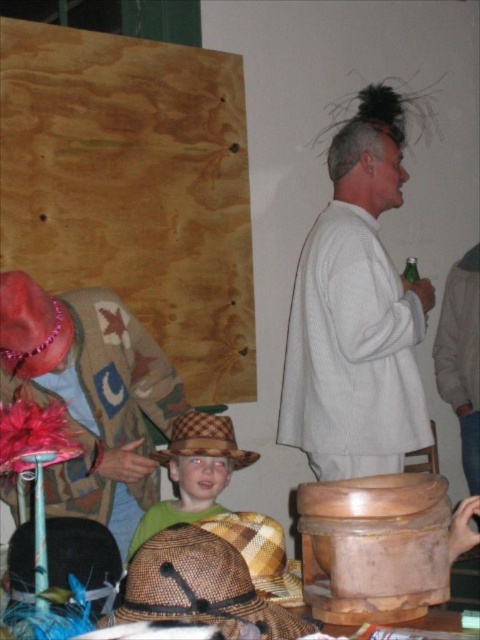
Between white knitted sweater at center and knitted wool sweater at center, which one appears on the left side from the viewer's perspective?

Positioned to the left is knitted wool sweater at center.

Can you confirm if white knitted sweater at center is taller than knitted wool sweater at center?

Yes, white knitted sweater at center is taller than knitted wool sweater at center.

Is point (410, 436) farther from camera compared to point (103, 465)?

Yes, point (410, 436) is behind point (103, 465).

Locate an element on the screen. white knitted sweater at center is located at coordinates (357, 312).

Is knitted wool sweater at center smaller than woven straw cowboy hat at center?

Incorrect, knitted wool sweater at center is not smaller in size than woven straw cowboy hat at center.

Does point (131, 536) come closer to viewer compared to point (176, 442)?

No, it is behind (176, 442).

I want to click on knitted wool sweater at center, so click(91, 396).

Who is lower down, woven straw cowboy hat at lower center or brown woven straw hat at lower center?

woven straw cowboy hat at lower center

I want to click on woven straw cowboy hat at lower center, so click(201, 586).

Locate an element on the screen. woven straw cowboy hat at lower center is located at coordinates click(201, 586).

The image size is (480, 640). What are the coordinates of `woven straw cowboy hat at lower center` in the screenshot? It's located at (201, 586).